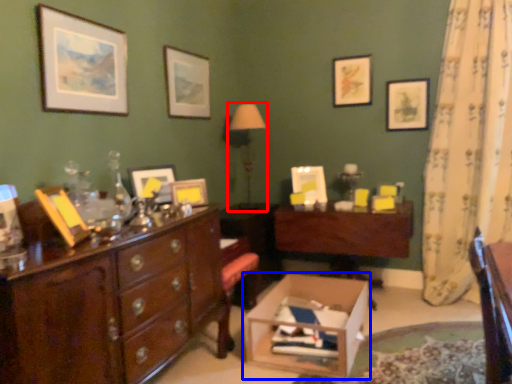
Question: Which object is closer to the camera taking this photo, table lamp (highlighted by a red box) or cardboard box (highlighted by a blue box)?

Choices:
 (A) table lamp
 (B) cardboard box

Answer: (B)